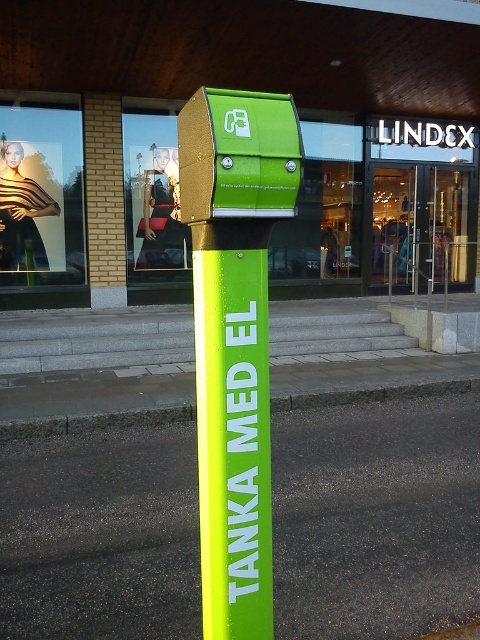
Question: Which of the following is the farthest from the observer?

Choices:
 (A) green rubber curb at lower center
 (B) neon green plastic post at center

Answer: (A)

Question: Among these points, which one is nearest to the camera?

Choices:
 (A) (423, 385)
 (B) (233, 298)

Answer: (B)

Question: Is neon green plastic post at center closer to camera compared to green rubber curb at lower center?

Choices:
 (A) no
 (B) yes

Answer: (B)

Question: Does neon green plastic post at center appear on the right side of green rubber curb at lower center?

Choices:
 (A) yes
 (B) no

Answer: (A)

Question: Does neon green plastic post at center have a lesser width compared to green rubber curb at lower center?

Choices:
 (A) no
 (B) yes

Answer: (B)

Question: Which point appears closest to the camera in this image?

Choices:
 (A) (235, 513)
 (B) (149, 408)

Answer: (A)